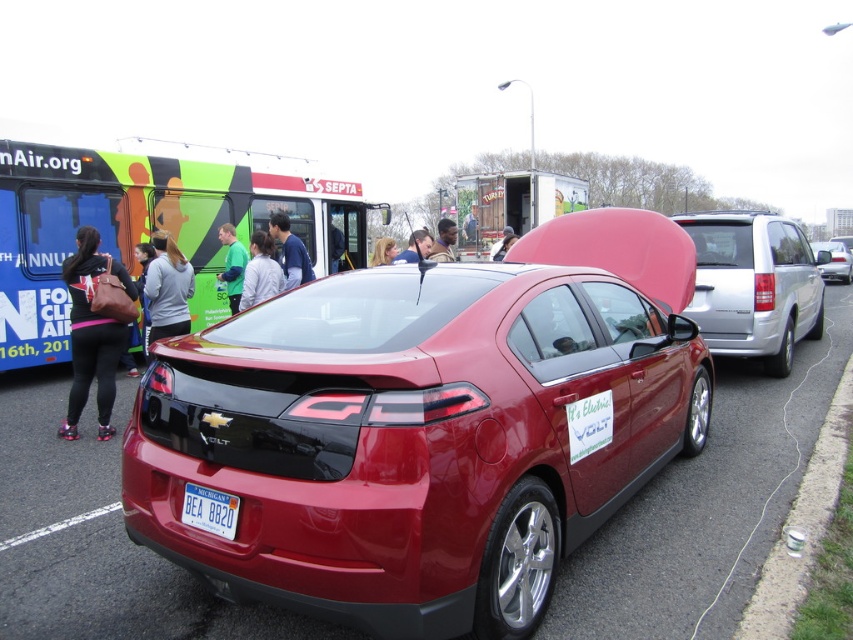
Question: From the image, what is the correct spatial relationship of matte black backpack at left in relation to gray fabric jacket at center?

Choices:
 (A) right
 (B) left

Answer: (B)

Question: In this image, where is silver metallic minivan at right located relative to blonde hair at center?

Choices:
 (A) right
 (B) left

Answer: (A)

Question: Which object is positioned farthest from the green matte bus at upper left?

Choices:
 (A) white plastic license plate at rear
 (B) gray fleece jacket at center
 (C) matte black jacket at center
 (D) glossy red car at center

Answer: (A)

Question: Is green matte bus at upper left bigger than blue denim jacket at center?

Choices:
 (A) yes
 (B) no

Answer: (B)

Question: Among these objects, which one is farthest from the camera?

Choices:
 (A) blonde hair at center
 (B) gray fleece jacket at center

Answer: (A)

Question: Which object is positioned farthest from the matte black backpack at left?

Choices:
 (A) smooth skin face at center
 (B) gray fabric jacket at center

Answer: (A)